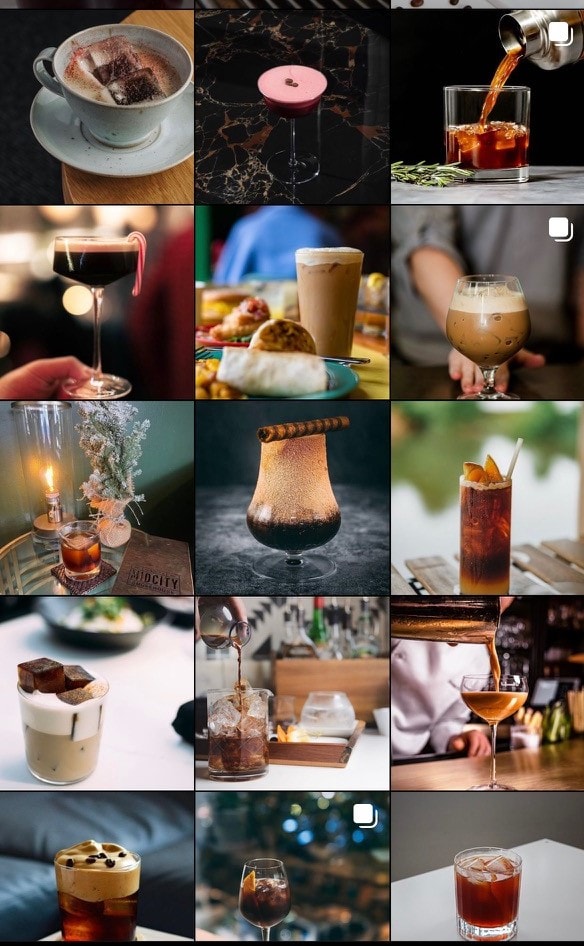
Locate an element on the screen. The height and width of the screenshot is (946, 584). stemmed glasses is located at coordinates coord(264,903), coord(495,699), coord(288,512), coord(495,331), coord(89,260), coord(294,106).